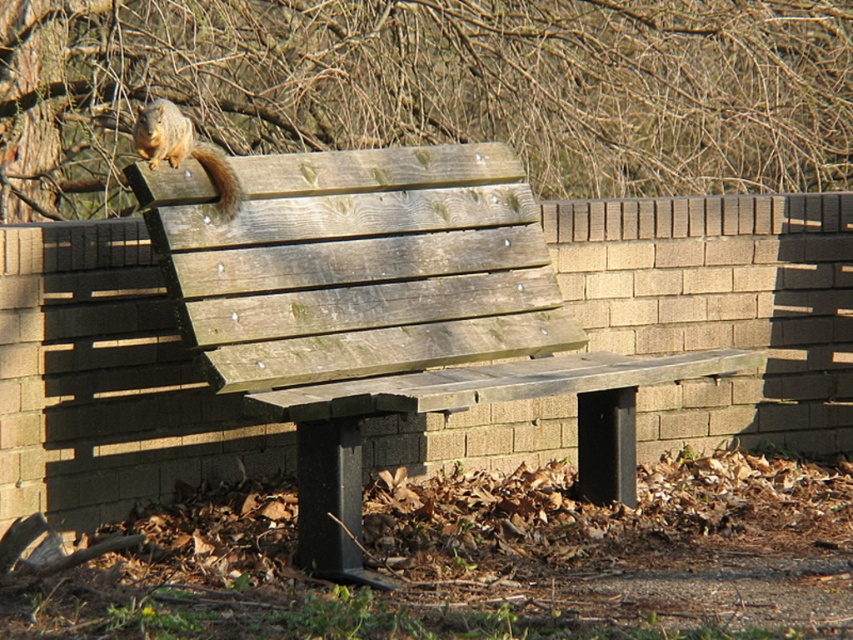
Question: Is brown wood tree at upper center to the left of weathered wood bench at center from the viewer's perspective?

Choices:
 (A) no
 (B) yes

Answer: (A)

Question: Can you confirm if brown wood tree at upper center is thinner than weathered wood bench at center?

Choices:
 (A) yes
 (B) no

Answer: (B)

Question: Observing the image, what is the correct spatial positioning of brown wood tree at upper center in reference to weathered wood bench at center?

Choices:
 (A) left
 (B) right

Answer: (B)

Question: Among these points, which one is nearest to the camera?

Choices:
 (A) (177, 260)
 (B) (775, 120)

Answer: (A)

Question: Among these objects, which one is nearest to the camera?

Choices:
 (A) weathered wood bench at center
 (B) brown wood tree at upper center

Answer: (A)